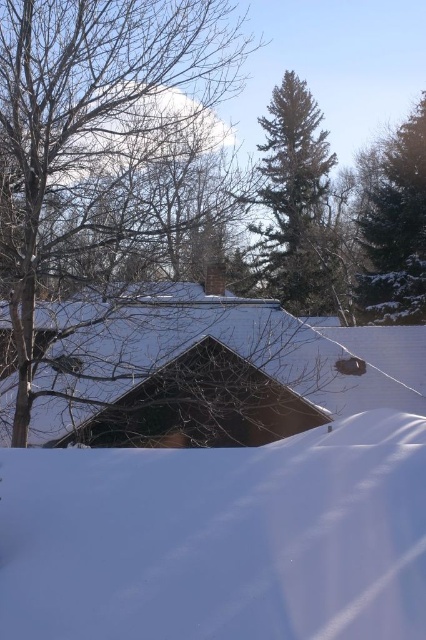
Can you confirm if bare branches at left is wider than green textured evergreen tree at upper right?

No, bare branches at left is not wider than green textured evergreen tree at upper right.

Can you confirm if bare branches at left is thinner than green textured evergreen tree at upper right?

Yes, bare branches at left is thinner than green textured evergreen tree at upper right.

Image resolution: width=426 pixels, height=640 pixels. Identify the location of bare branches at left. (100, 138).

Is point (75, 596) closer to viewer compared to point (39, 161)?

Yes, point (75, 596) is in front of point (39, 161).

Between white fluffy snow at lower center and bare branches at left, which one is positioned higher?

bare branches at left

Which is in front, point (267, 621) or point (19, 348)?

Positioned in front is point (267, 621).

The width and height of the screenshot is (426, 640). What are the coordinates of `white fluffy snow at lower center` in the screenshot? It's located at (219, 538).

Is bare branches at left taller than green needle-like tree at upper center?

In fact, bare branches at left may be shorter than green needle-like tree at upper center.

Is bare branches at left in front of green needle-like tree at upper center?

Yes.

Locate an element on the screen. This screenshot has height=640, width=426. bare branches at left is located at coordinates (100, 138).